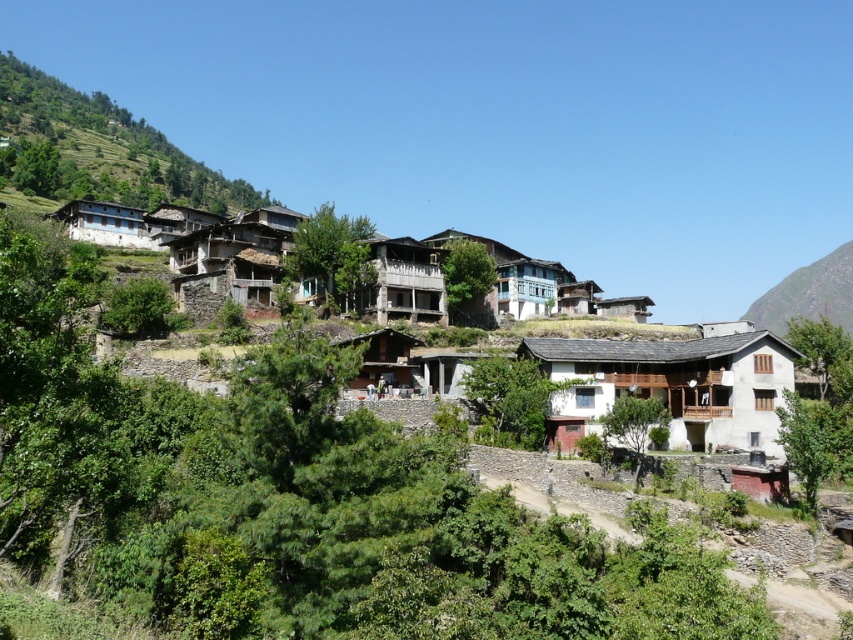
You are a landscape photographer planning to capture the village scene. You want to ensure both the rustic stone houses at center and the rugged stone mountain at upper right are visible in your shot. Based on their sizes in the image, which object should you prioritize framing closer to the edge of the photo to avoid overcrowding?

The rustic stone houses at center occupies less space than rugged stone stone mountain at upper right, so you should prioritize framing the rustic stone houses at center closer to the edge to avoid overcrowding since it takes up less area in the image.

You are standing in the village and want to take a photo of both the rustic stone houses at center and the rugged stone mountain at upper right. Which object will appear larger in the photo?

The rustic stone houses at center will appear larger in the photo because they are closer to the viewer than the rugged stone mountain at upper right.